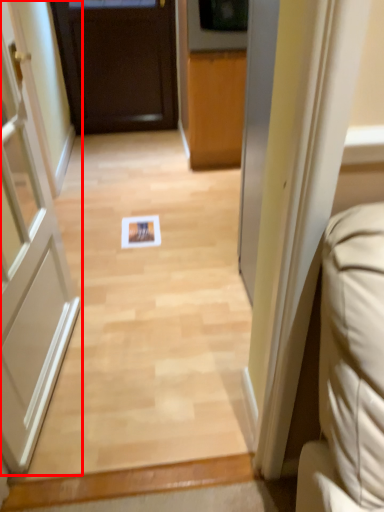
Question: From the image, what is the correct spatial relationship of door (annotated by the red box) in relation to door?

Choices:
 (A) right
 (B) left

Answer: (A)